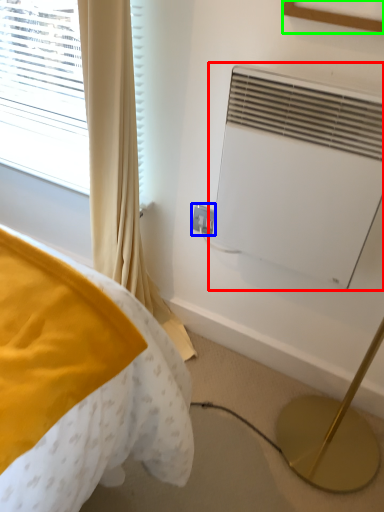
Question: Considering the real-world distances, which object is farthest from air conditioning (highlighted by a red box)? electric outlet (highlighted by a blue box) or picture frame (highlighted by a green box)?

Choices:
 (A) electric outlet
 (B) picture frame

Answer: (A)